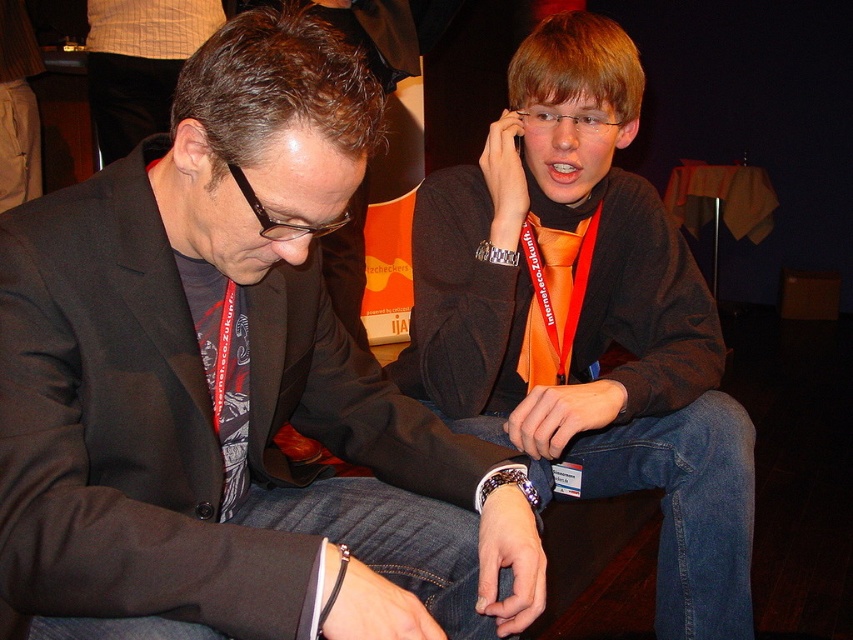
Between point (122, 372) and point (744, 564), which one is positioned in front?

Point (122, 372)

Is the position of matte black jacket at center less distant than that of orange fabric tie at center?

Yes, matte black jacket at center is closer to the viewer.

Who is more forward, (134, 406) or (627, 404)?

Positioned in front is point (134, 406).

Locate an element on the screen. The height and width of the screenshot is (640, 853). matte black jacket at center is located at coordinates (231, 387).

Which is behind, point (231, 428) or point (556, 356)?

Positioned behind is point (556, 356).

At what (x,y) coordinates should I click in order to perform the action: click on matte black jacket at center. Please return your answer as a coordinate pair (x, y). Image resolution: width=853 pixels, height=640 pixels. Looking at the image, I should click on (231, 387).

You are a GUI agent. You are given a task and a screenshot of the screen. Output one action in this format:
    pyautogui.click(x=<x>, y=<y>)
    Task: Click on the matte black jacket at center
    
    Given the screenshot: What is the action you would take?
    pyautogui.click(x=231, y=387)

Who is higher up, orange fabric tie at center or orange satin tie at center?

Positioned higher is orange satin tie at center.

Can you confirm if orange fabric tie at center is positioned to the right of orange satin tie at center?

Incorrect, orange fabric tie at center is not on the right side of orange satin tie at center.

Who is more distant from viewer, (572, 449) or (532, 332)?

The point (532, 332) is behind.

Find the location of `orange fabric tie at center`. orange fabric tie at center is located at coordinates (585, 317).